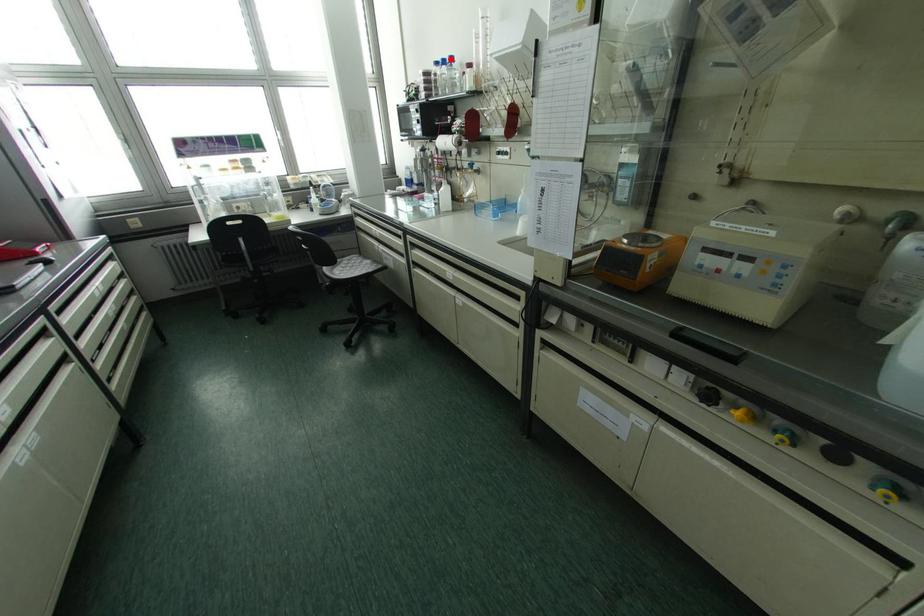
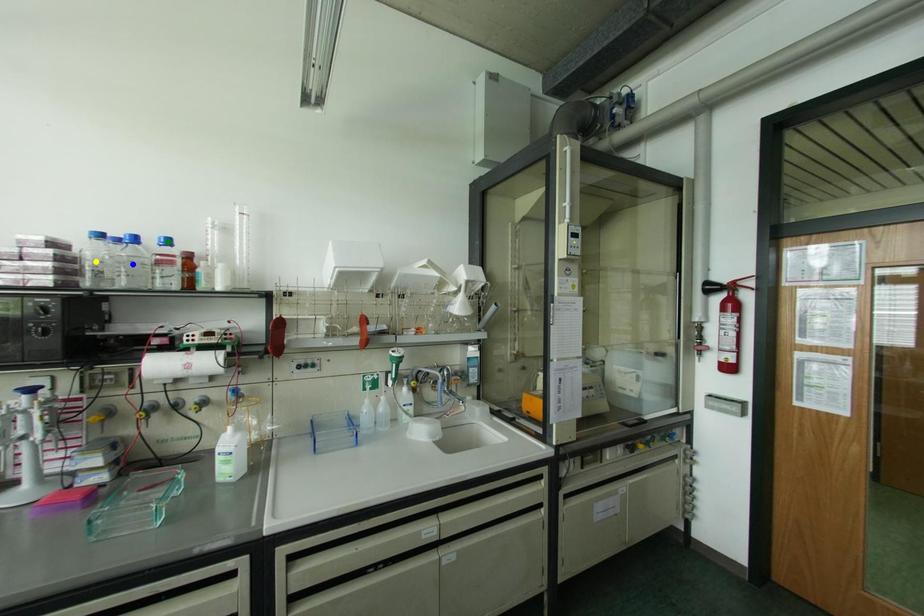
Question: I am providing you with two images of the same scene from different viewpoints. A red point is marked on the first image. You are given multiple points on the second image. Which point in image 2 is actually the same real-world point as the red point in image 1?

Choices:
 (A) green point
 (B) blue point
 (C) yellow point

Answer: (A)